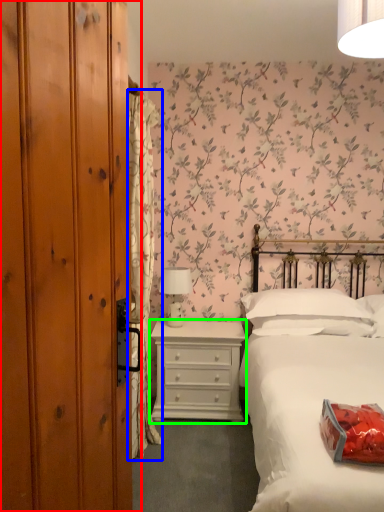
Question: Based on their relative distances, which object is nearer to dresser (highlighted by a red box)? Choose from curtain (highlighted by a blue box) and chest of drawers (highlighted by a green box).

Choices:
 (A) curtain
 (B) chest of drawers

Answer: (A)